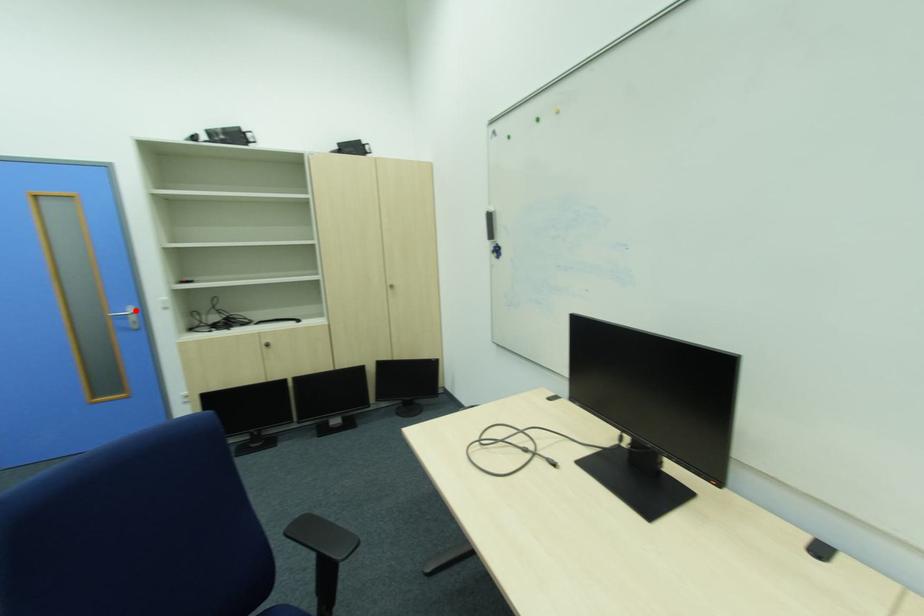
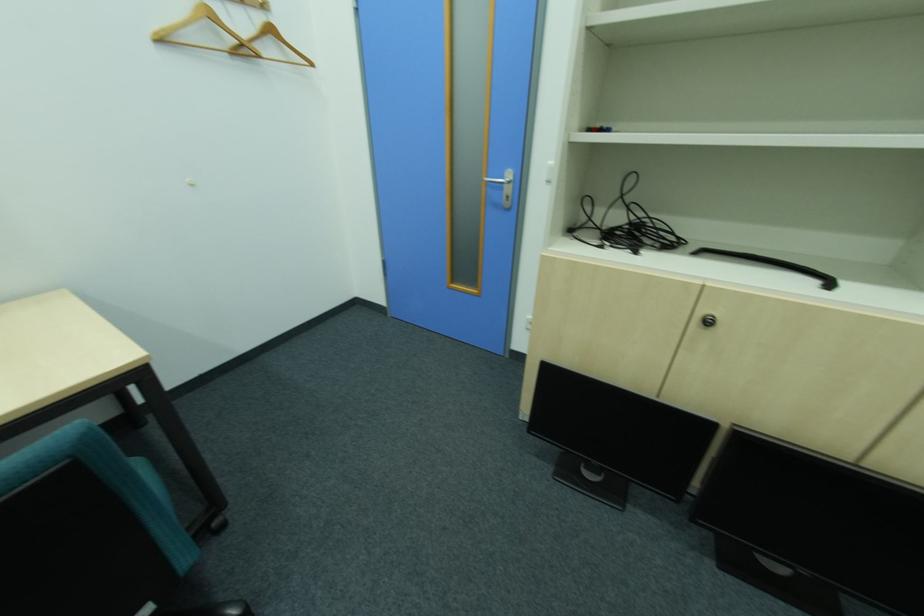
Question: A red point is marked in image1. In image2, is the corresponding 3D point closer to the camera or farther? Reply with the corresponding letter.

Choices:
 (A) The corresponding 3D point is closer.
 (B) The corresponding 3D point is farther.

Answer: (A)